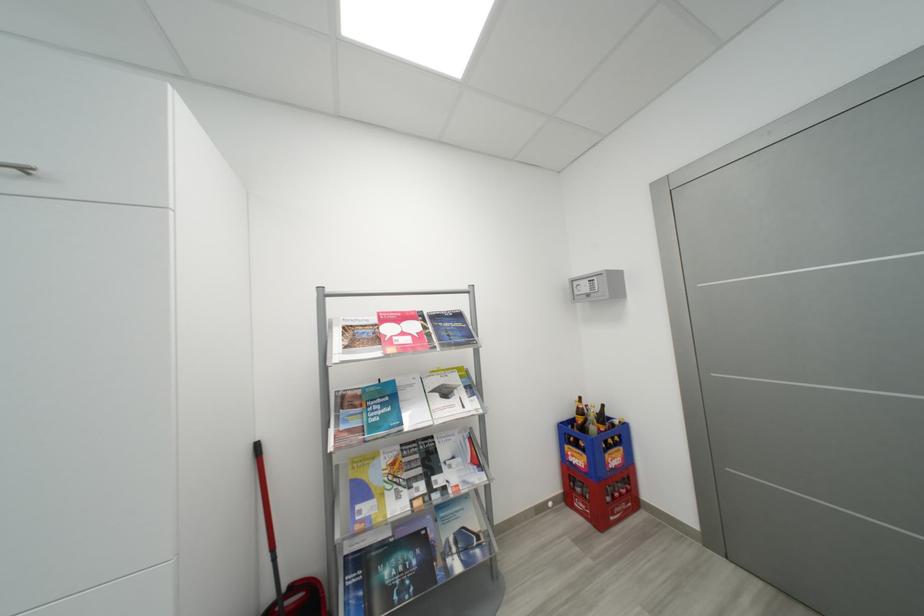
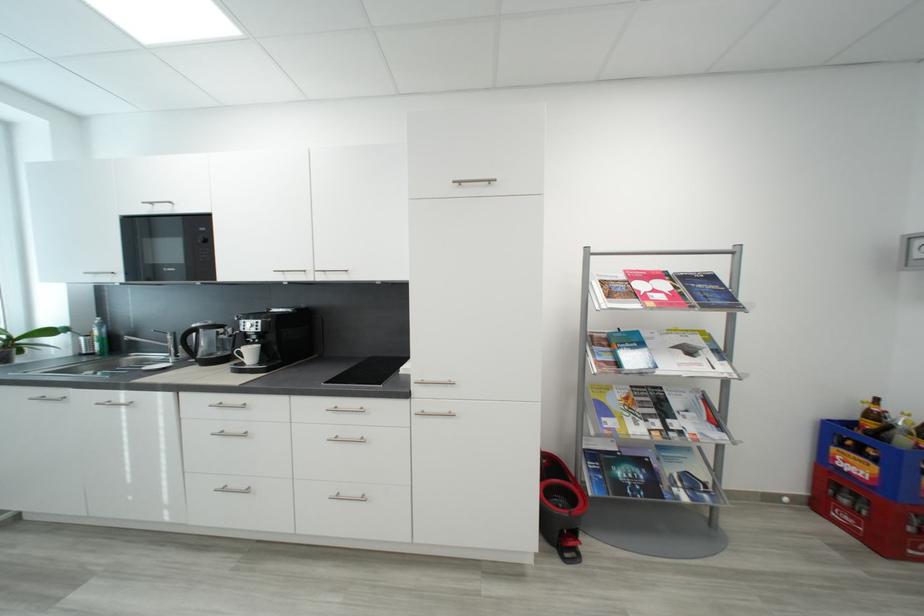
The point at (426, 541) is marked in the first image. Where is the corresponding point in the second image?

(650, 464)